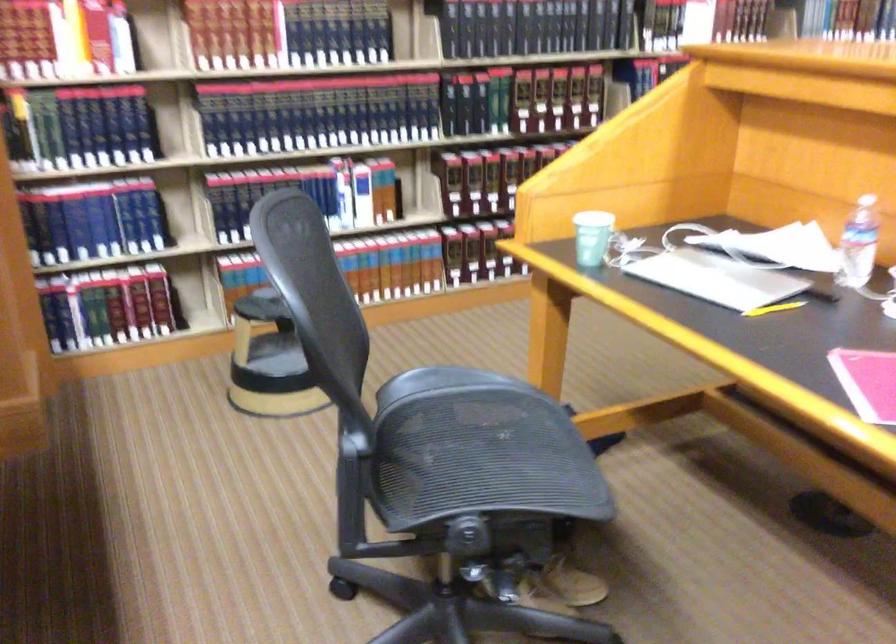
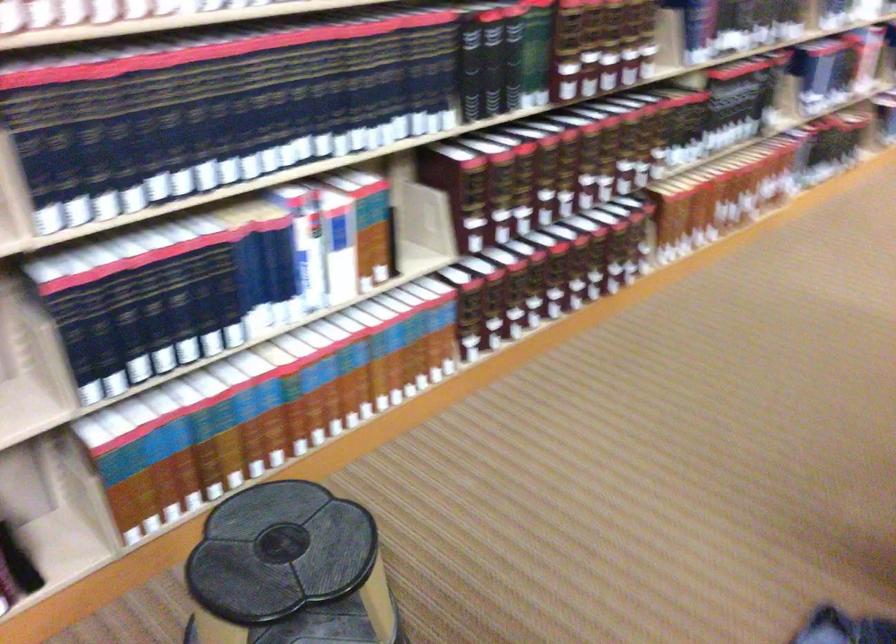
The point at [212,200] is marked in the first image. Where is the corresponding point in the second image?

(85, 325)